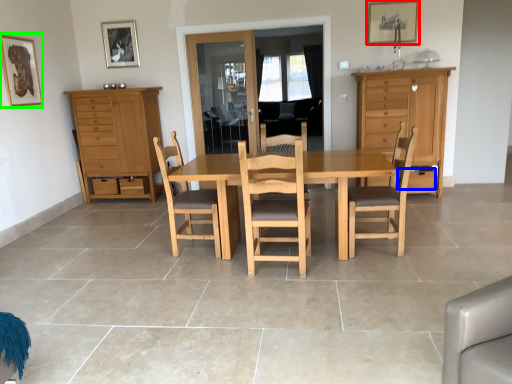
Question: Estimate the real-world distances between objects in this image. Which object is closer to picture frame (highlighted by a red box), drawer (highlighted by a blue box) or picture frame (highlighted by a green box)?

Choices:
 (A) drawer
 (B) picture frame

Answer: (A)